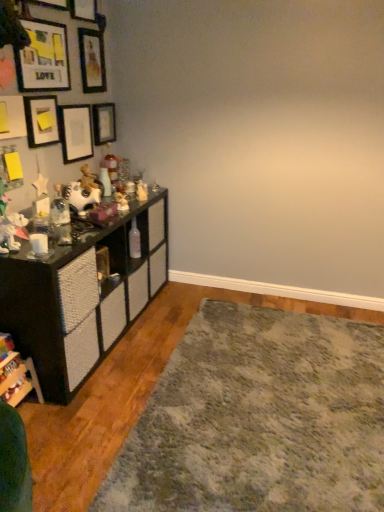
In order to face matte black picture frame at upper left, the second picture frame positioned from the top, should I rotate leftwards or rightwards?

To align with it, rotate left about 12.796°.

The width and height of the screenshot is (384, 512). What do you see at coordinates (75, 132) in the screenshot?
I see `matte black picture frame at upper left, marked as the 2th picture frame in a bottom-to-top arrangement` at bounding box center [75, 132].

What is the approximate width of yellow paper at upper left, acting as the sixth picture frame starting from the top?

The width of yellow paper at upper left, acting as the sixth picture frame starting from the top, is 2.02 inches.

At what (x,y) coordinates should I click in order to perform the action: click on wooden picture frame at upper left, which is the sixth picture frame in bottom-to-top order. Please return your answer as a coordinate pair (x, y). The width and height of the screenshot is (384, 512). Looking at the image, I should click on (84, 10).

This screenshot has width=384, height=512. In order to click on wooden bookshelf at lower left, the 2th shelf in the back-to-front sequence in this screenshot , I will do `click(21, 383)`.

Identify the location of matte black picture frame at upper center, which ranks as the fourth picture frame in top-to-bottom order. This screenshot has width=384, height=512. (104, 123).

Locate an element on the screen. The height and width of the screenshot is (512, 384). shaggy gray rug at lower right is located at coordinates (259, 419).

Is matte black picture frame at upper left, the second picture frame positioned from the top, beside wooden picture frame at upper left, the 1th picture frame when ordered from top to bottom?

No, matte black picture frame at upper left, the second picture frame positioned from the top, is not in contact with wooden picture frame at upper left, the 1th picture frame when ordered from top to bottom.

Does matte black picture frame at upper left, the second picture frame positioned from the top, come behind wooden picture frame at upper left, which is the sixth picture frame in bottom-to-top order?

That is True.

From their relative heights in the image, would you say matte black picture frame at upper left, the second picture frame positioned from the top, is taller or shorter than wooden picture frame at upper left, which is the sixth picture frame in bottom-to-top order?

Clearly, matte black picture frame at upper left, the second picture frame positioned from the top, is taller compared to wooden picture frame at upper left, which is the sixth picture frame in bottom-to-top order.

Is point (83, 38) farther from viewer compared to point (85, 0)?

Yes, point (83, 38) is behind point (85, 0).

Can you confirm if black textured cabinet at left, acting as the second shelf starting from the front, is thinner than matte black picture frame at upper center, which ranks as the fourth picture frame in top-to-bottom order?

No.

Can you confirm if black textured cabinet at left, the 1th shelf in the back-to-front sequence, is taller than matte black picture frame at upper center, which is the third picture frame in bottom-to-top order?

Correct, black textured cabinet at left, the 1th shelf in the back-to-front sequence, is much taller as matte black picture frame at upper center, which is the third picture frame in bottom-to-top order.

Is black textured cabinet at left, the 1th shelf in the back-to-front sequence, positioned behind matte black picture frame at upper center, which ranks as the fourth picture frame in top-to-bottom order?

No, the depth of black textured cabinet at left, the 1th shelf in the back-to-front sequence, is less than that of matte black picture frame at upper center, which ranks as the fourth picture frame in top-to-bottom order.

Is matte black picture frame at upper left, marked as the 2th picture frame in a bottom-to-top arrangement, not inside matte black picture frame at upper left, the second picture frame positioned from the top?

That's correct, matte black picture frame at upper left, marked as the 2th picture frame in a bottom-to-top arrangement, is outside of matte black picture frame at upper left, the second picture frame positioned from the top.

Does matte black picture frame at upper left, marked as the 2th picture frame in a bottom-to-top arrangement, have a smaller size compared to matte black picture frame at upper left, the second picture frame positioned from the top?

Correct, matte black picture frame at upper left, marked as the 2th picture frame in a bottom-to-top arrangement, occupies less space than matte black picture frame at upper left, the second picture frame positioned from the top.

The image size is (384, 512). Find the location of `picture frame that is the 2nd object to the right of the matte black picture frame at upper left, positioned as the fifth picture frame in top-to-bottom order, starting at the anchor`. picture frame that is the 2nd object to the right of the matte black picture frame at upper left, positioned as the fifth picture frame in top-to-bottom order, starting at the anchor is located at coordinates (92, 60).

Which of these two, matte black picture frame at upper left, positioned as the fifth picture frame in top-to-bottom order, or wooden picture frame at upper left, placed as the 4th picture frame when sorted from bottom to top, is bigger?

wooden picture frame at upper left, placed as the 4th picture frame when sorted from bottom to top.

Is matte black picture frame at upper left, positioned as the fifth picture frame in top-to-bottom order, in front of wooden picture frame at upper left, placed as the 4th picture frame when sorted from bottom to top?

That is False.

Is wooden bookshelf at lower left, which is the first shelf in front-to-back order, oriented away from matte black picture frame at upper left, the second picture frame positioned from the top?

No, wooden bookshelf at lower left, which is the first shelf in front-to-back order,'s orientation is not away from matte black picture frame at upper left, the second picture frame positioned from the top.

Is matte black picture frame at upper left, the second picture frame positioned from the top, completely or partially inside wooden bookshelf at lower left, the 2th shelf in the back-to-front sequence?

No.

Considering the positions of objects wooden bookshelf at lower left, which is the first shelf in front-to-back order, and matte black picture frame at upper left, the second picture frame positioned from the top, in the image provided, who is behind, wooden bookshelf at lower left, which is the first shelf in front-to-back order, or matte black picture frame at upper left, the second picture frame positioned from the top,?

matte black picture frame at upper left, the second picture frame positioned from the top.

How many degrees apart are the facing directions of wooden bookshelf at lower left, the 2th shelf in the back-to-front sequence, and matte black picture frame at upper left, the second picture frame positioned from the top?

The angle between the facing direction of wooden bookshelf at lower left, the 2th shelf in the back-to-front sequence, and the facing direction of matte black picture frame at upper left, the second picture frame positioned from the top, is 0.947 degrees.

What are the coordinates of `the 2nd picture frame behind the shaggy gray rug at lower right, starting your count from the anchor` in the screenshot? It's located at (41, 121).

Is point (286, 419) closer or farther from the camera than point (45, 115)?

Point (286, 419).

Which is more to the left, shaggy gray rug at lower right or yellow paper at upper left, which appears as the 1th picture frame when ordered from the bottom?

yellow paper at upper left, which appears as the 1th picture frame when ordered from the bottom.

Is wooden picture frame at upper left, placed as the 4th picture frame when sorted from bottom to top, taller or shorter than wooden picture frame at upper left, which is the sixth picture frame in bottom-to-top order?

wooden picture frame at upper left, placed as the 4th picture frame when sorted from bottom to top, is taller than wooden picture frame at upper left, which is the sixth picture frame in bottom-to-top order.

Locate an element on the screen. The width and height of the screenshot is (384, 512). the 2nd picture frame in front of the wooden picture frame at upper left, the 1th picture frame when ordered from top to bottom, counting from the anchor's position is located at coordinates (43, 58).

How different are the orientations of wooden picture frame at upper left, positioned as the 3th picture frame in top-to-bottom order, and wooden picture frame at upper left, which is the sixth picture frame in bottom-to-top order, in degrees?

There is a 0.915-degree angle between the facing directions of wooden picture frame at upper left, positioned as the 3th picture frame in top-to-bottom order, and wooden picture frame at upper left, which is the sixth picture frame in bottom-to-top order.

Would you say wooden picture frame at upper left, positioned as the 3th picture frame in top-to-bottom order, is outside wooden picture frame at upper left, the 1th picture frame when ordered from top to bottom?

Yes, wooden picture frame at upper left, positioned as the 3th picture frame in top-to-bottom order, is outside of wooden picture frame at upper left, the 1th picture frame when ordered from top to bottom.

Where is `picture frame that is the 1st object to the left of the matte black picture frame at upper left, the 5th picture frame positioned from the bottom, starting at the anchor`? The image size is (384, 512). picture frame that is the 1st object to the left of the matte black picture frame at upper left, the 5th picture frame positioned from the bottom, starting at the anchor is located at coordinates [x=84, y=10].

From the image's perspective, count 3rd picture frames upward from the black textured cabinet at left, the 1th shelf in the back-to-front sequence, and point to it. Please provide its 2D coordinates.

[(104, 123)]

From the image, which object appears to be nearer to yellow paper at upper left, acting as the sixth picture frame starting from the top, wooden picture frame at upper left, the 1th picture frame when ordered from top to bottom, or matte black picture frame at upper left, marked as the 2th picture frame in a bottom-to-top arrangement?

matte black picture frame at upper left, marked as the 2th picture frame in a bottom-to-top arrangement, is positioned closer to the anchor yellow paper at upper left, acting as the sixth picture frame starting from the top.

Looking at the image, which one is located closer to black textured cabinet at left, acting as the second shelf starting from the front, matte black picture frame at upper left, the 5th picture frame positioned from the bottom, or yellow paper at upper left, which appears as the 1th picture frame when ordered from the bottom?

Based on the image, yellow paper at upper left, which appears as the 1th picture frame when ordered from the bottom, appears to be nearer to black textured cabinet at left, acting as the second shelf starting from the front.

Which object lies further to the anchor point wooden picture frame at upper left, which is the sixth picture frame in bottom-to-top order, wooden bookshelf at lower left, the 2th shelf in the back-to-front sequence, or wooden picture frame at upper left, positioned as the 3th picture frame in top-to-bottom order?

wooden bookshelf at lower left, the 2th shelf in the back-to-front sequence.

Based on their spatial positions, is matte black picture frame at upper center, which is the third picture frame in bottom-to-top order, or matte black picture frame at upper left, the 5th picture frame positioned from the bottom, closer to black textured cabinet at left, acting as the second shelf starting from the front?

Among the two, matte black picture frame at upper center, which is the third picture frame in bottom-to-top order, is located nearer to black textured cabinet at left, acting as the second shelf starting from the front.

Looking at the image, which one is located closer to matte black picture frame at upper center, which ranks as the fourth picture frame in top-to-bottom order, shaggy gray rug at lower right or yellow paper at upper left, which appears as the 1th picture frame when ordered from the bottom?

Based on the image, yellow paper at upper left, which appears as the 1th picture frame when ordered from the bottom, appears to be nearer to matte black picture frame at upper center, which ranks as the fourth picture frame in top-to-bottom order.

Estimate the real-world distances between objects in this image. Which object is closer to yellow paper at upper left, acting as the sixth picture frame starting from the top, matte black picture frame at upper left, marked as the 2th picture frame in a bottom-to-top arrangement, or shaggy gray rug at lower right?

matte black picture frame at upper left, marked as the 2th picture frame in a bottom-to-top arrangement, is positioned closer to the anchor yellow paper at upper left, acting as the sixth picture frame starting from the top.

From the image, which object appears to be nearer to matte black picture frame at upper left, marked as the 2th picture frame in a bottom-to-top arrangement, yellow paper at upper left, acting as the sixth picture frame starting from the top, or wooden bookshelf at lower left, which is the first shelf in front-to-back order?

Among the two, yellow paper at upper left, acting as the sixth picture frame starting from the top, is located nearer to matte black picture frame at upper left, marked as the 2th picture frame in a bottom-to-top arrangement.

Based on their spatial positions, is yellow paper at upper left, acting as the sixth picture frame starting from the top, or matte black picture frame at upper left, positioned as the fifth picture frame in top-to-bottom order, closer to matte black picture frame at upper left, the second picture frame positioned from the top?

matte black picture frame at upper left, positioned as the fifth picture frame in top-to-bottom order.

Find the location of `shelf between matte black picture frame at upper left, marked as the 2th picture frame in a bottom-to-top arrangement, and wooden bookshelf at lower left, which is the first shelf in front-to-back order, in the up-down direction`. shelf between matte black picture frame at upper left, marked as the 2th picture frame in a bottom-to-top arrangement, and wooden bookshelf at lower left, which is the first shelf in front-to-back order, in the up-down direction is located at coordinates (82, 294).

In order to click on picture frame between matte black picture frame at upper left, marked as the 2th picture frame in a bottom-to-top arrangement, and shaggy gray rug at lower right from top to bottom in this screenshot , I will do `click(41, 121)`.

Locate an element on the screen. shelf between yellow paper at upper left, which appears as the 1th picture frame when ordered from the bottom, and wooden bookshelf at lower left, the 2th shelf in the back-to-front sequence, from top to bottom is located at coordinates (82, 294).

Locate an element on the screen. The height and width of the screenshot is (512, 384). picture frame between matte black picture frame at upper left, positioned as the fifth picture frame in top-to-bottom order, and wooden bookshelf at lower left, which is the first shelf in front-to-back order, from top to bottom is located at coordinates (41, 121).